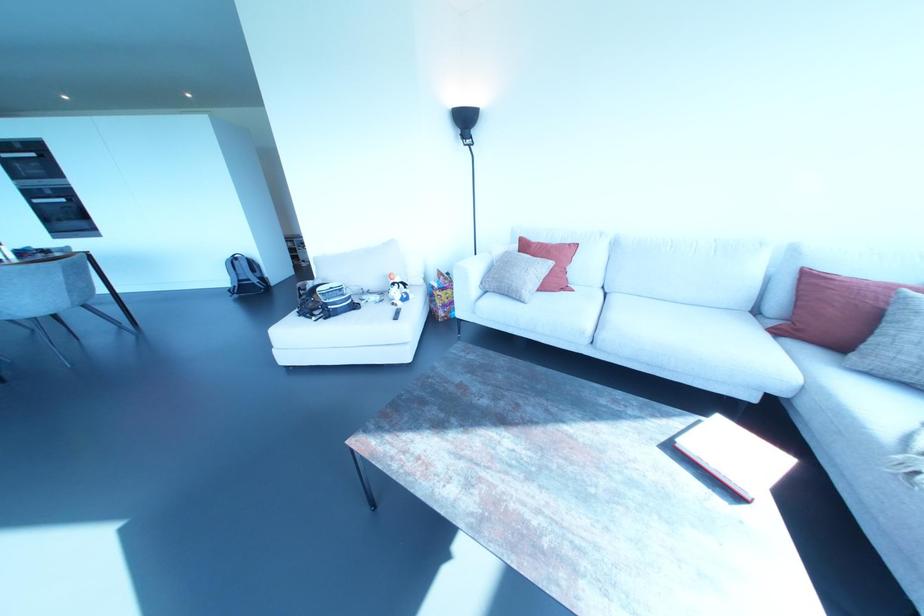
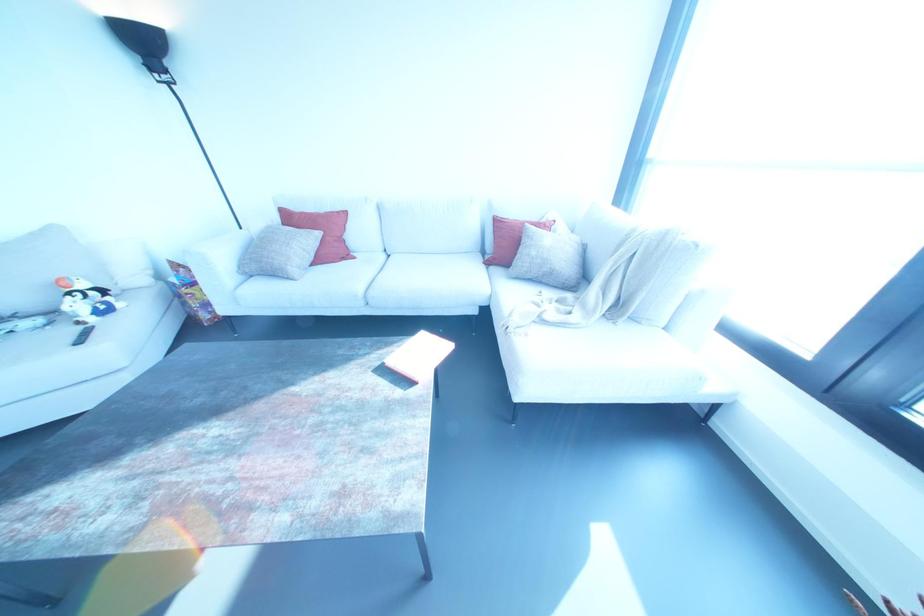
Locate, in the second image, the point that corresponds to point (395, 317) in the first image.

(78, 341)